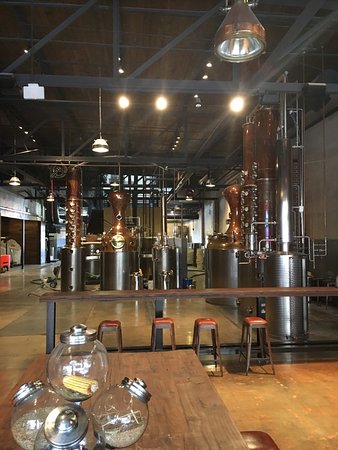
The image size is (338, 450). Identify the location of ceiling. (76, 58).